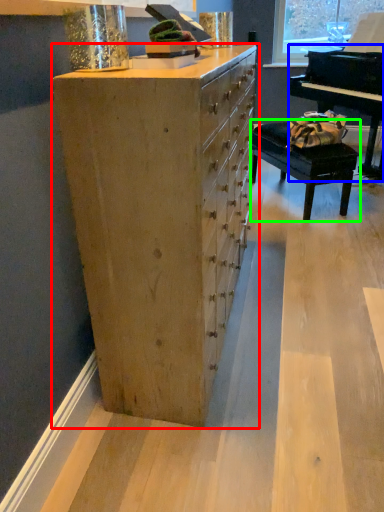
Question: Which object is the farthest from chest of drawers (highlighted by a red box)? Choose among these: piano (highlighted by a blue box) or table (highlighted by a green box).

Choices:
 (A) piano
 (B) table

Answer: (B)